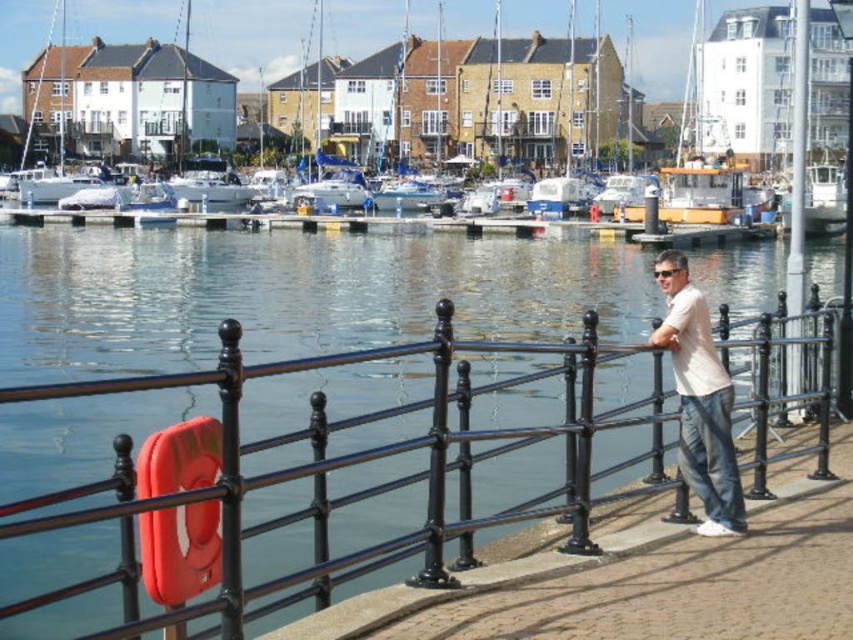
Question: Considering the relative positions of white plastic boat at center and white cotton shirt at center in the image provided, where is white plastic boat at center located with respect to white cotton shirt at center?

Choices:
 (A) below
 (B) above

Answer: (B)

Question: Which object is positioned closest to the white plastic boat at center?

Choices:
 (A) black metal fence at center
 (B) white cotton shirt at center

Answer: (A)

Question: Does black metal fence at center have a greater width compared to white cotton shirt at center?

Choices:
 (A) yes
 (B) no

Answer: (A)

Question: Which point is closer to the camera?

Choices:
 (A) (221, 48)
 (B) (674, 330)
 (C) (227, 634)

Answer: (C)

Question: Is black metal fence at center smaller than white plastic boat at center?

Choices:
 (A) no
 (B) yes

Answer: (B)

Question: Among these points, which one is nearest to the camera?

Choices:
 (A) (815, 417)
 (B) (345, 12)
 (C) (740, 513)

Answer: (C)